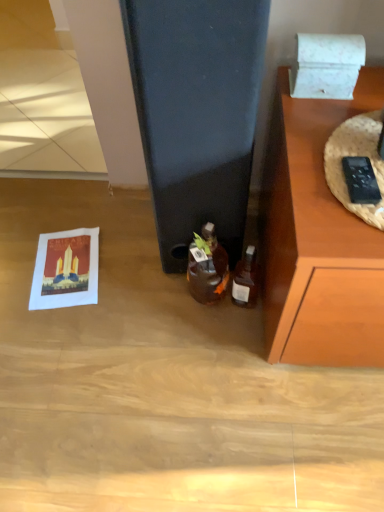
Identify the location of vacant space in front of translucent glass bottle at center, positioned as the 1th bottle in left-to-right order. This screenshot has height=512, width=384. (204, 348).